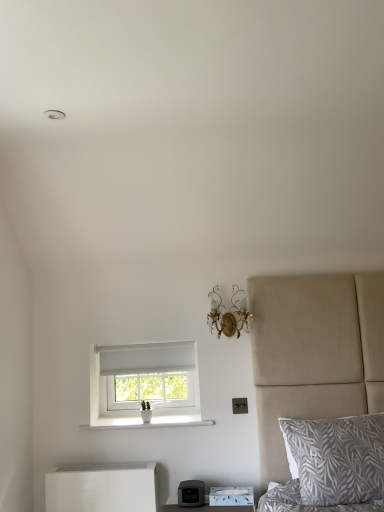
This screenshot has width=384, height=512. I want to click on vacant space underneath white fabric window at center (from a real-world perspective), so [x=129, y=418].